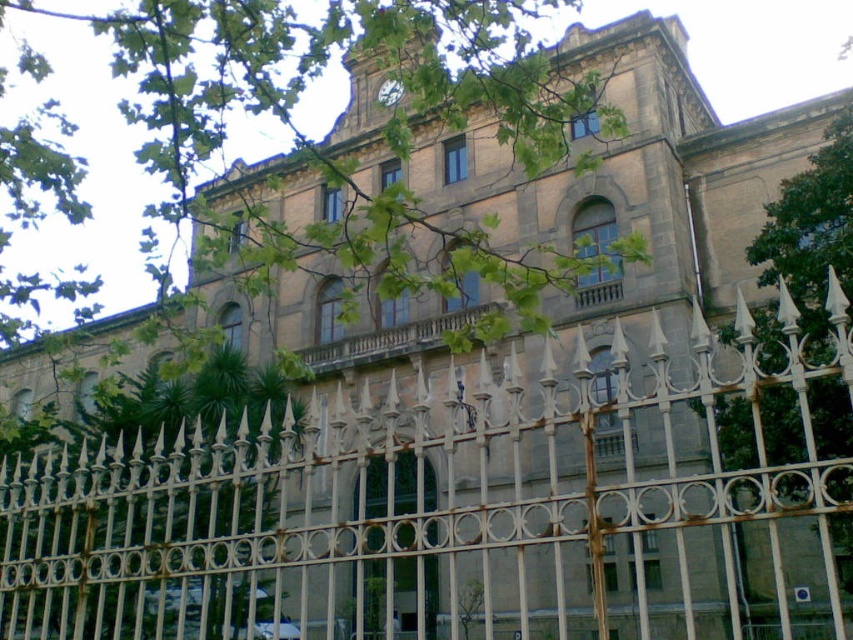
You are a delivery person trying to enter the building shown in the image. You see a rusty metal fence at center. Can you walk through the entrance located at point (465, 502)?

The entrance is blocked by a rusty metal fence at center located at point (465, 502), so you cannot walk through it.

You are a maintenance worker who needs to reach the rusty metal fence at center from the green leafy tree at upper left. Given that your ladder is 15 meters long, can you safely reach the fence without moving the ladder?

The distance between the rusty metal fence at center and the green leafy tree at upper left is 18.02 meters. Since the ladder is only 15 meters long, it is not long enough to bridge the gap between the rusty metal fence at center and the green leafy tree at upper left safely.